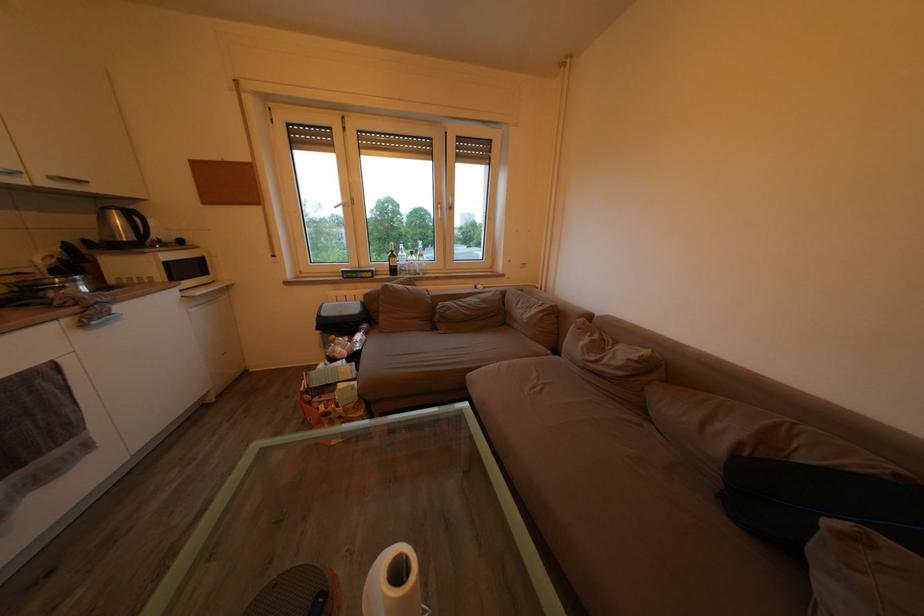
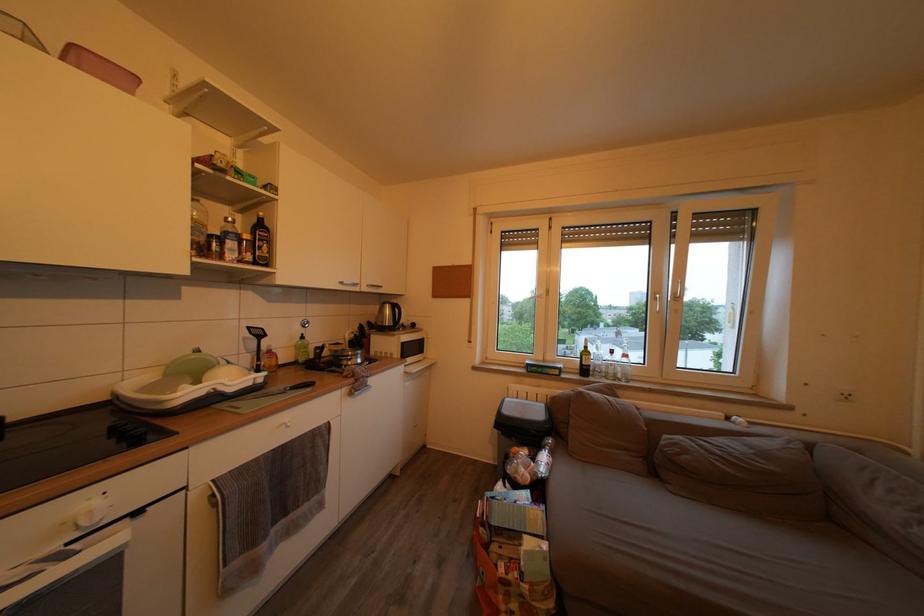
Where in the second image is the point corresponding to (x=410, y=269) from the first image?

(608, 369)